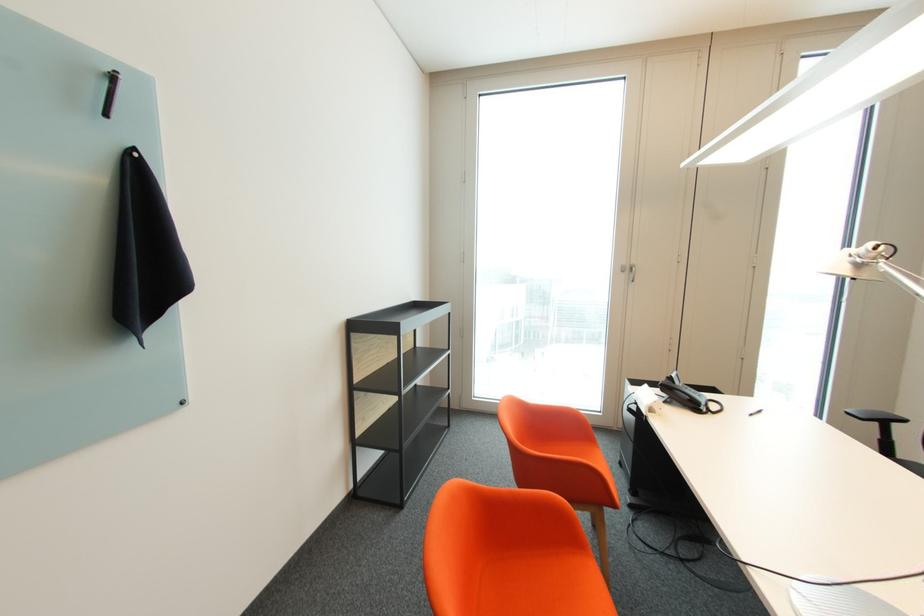
What do you see at coordinates (110, 92) in the screenshot?
I see `a black wall hook` at bounding box center [110, 92].